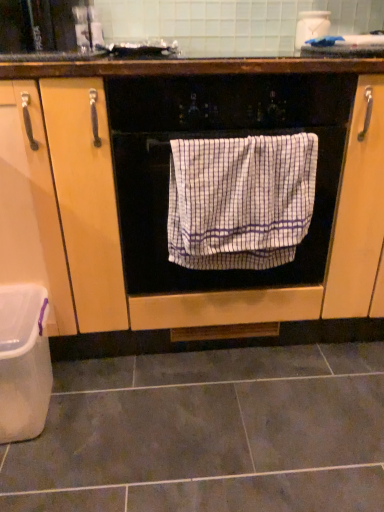
Question: Considering the positions of white checkered towel at center and gray matte tile at lower center in the image, is white checkered towel at center taller or shorter than gray matte tile at lower center?

Choices:
 (A) short
 (B) tall

Answer: (B)

Question: Is white checkered towel at center situated inside gray matte tile at lower center or outside?

Choices:
 (A) outside
 (B) inside

Answer: (A)

Question: Estimate the real-world distances between objects in this image. Which object is farther from the white checkered towel at center?

Choices:
 (A) gray matte tile at lower center
 (B) white wood cabinet at center
 (C) white checkered towel at center
 (D) white plastic container at lower left

Answer: (A)

Question: Considering the real-world distances, which object is closest to the gray matte tile at lower center?

Choices:
 (A) white plastic container at lower left
 (B) white wood cabinet at center
 (C) white checkered towel at center
 (D) white checkered towel at center

Answer: (A)